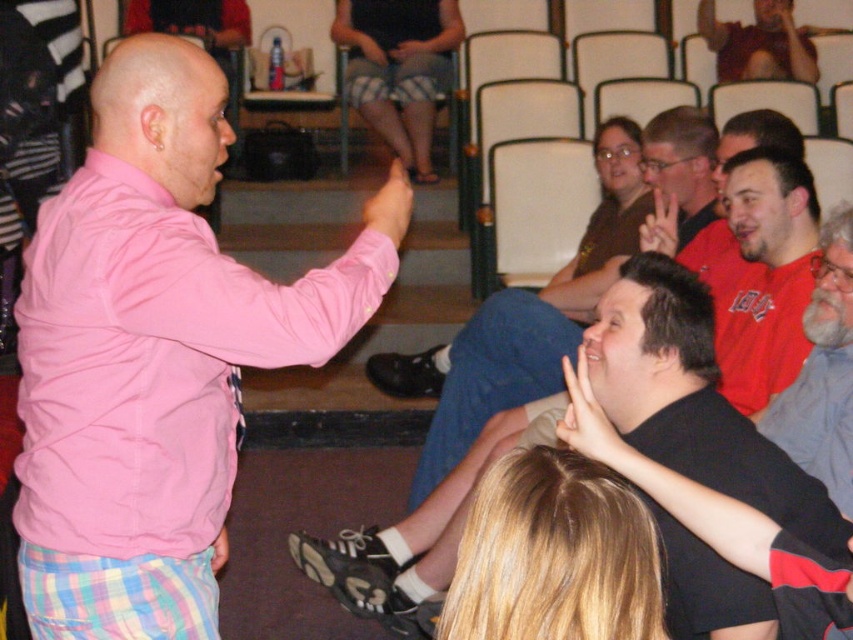
You are a photographer setting up for a group photo. You notice the gray fabric shirt at right and the white matte hand at center. Which object should you focus on first if you want to capture the larger one in detail?

The gray fabric shirt at right is larger than the white matte hand at center, so you should focus on the gray fabric shirt at right first to capture it in detail.

Based on the photo, you are organizing a charity event and need to seat two volunteers, one wearing a pink cotton shirt at left and the other in a gray fabric shirt at right. The chairs available are exactly the same width as each volunteer. Which volunteer should you seat first to ensure both can be accommodated?

The pink cotton shirt at left might be wider than gray fabric shirt at right, so you should seat the volunteer in the pink cotton shirt at left first to ensure there is enough space for both.

You are a photographer at the event and want to capture a photo of the gray fabric shirt at right without the white matte hand at center blocking it. Which object should you move to achieve this?

The gray fabric shirt at right is positioned under the white matte hand at center. To avoid the hand blocking the shirt, you should move the white matte hand at center.